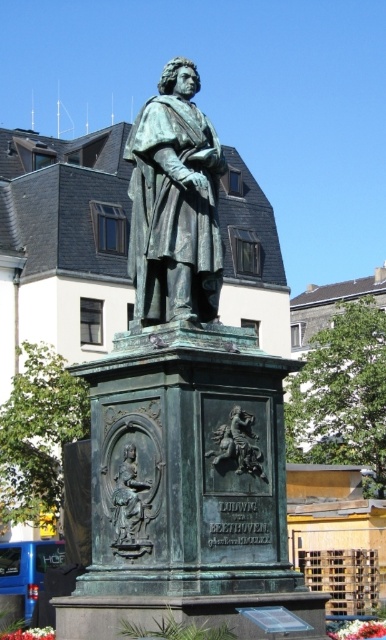
Question: Which object is positioned farthest from the bronze relief figure at center?

Choices:
 (A) bronze relief horse at center
 (B) bronze statue at center

Answer: (B)

Question: Does green patinated bronze statue at center have a smaller size compared to bronze relief figure at center?

Choices:
 (A) yes
 (B) no

Answer: (B)

Question: Estimate the real-world distances between objects in this image. Which object is closer to the bronze relief figure at center?

Choices:
 (A) green patinated bronze statue at center
 (B) bronze relief horse at center

Answer: (A)

Question: Can you confirm if green patinated bronze statue at center is positioned to the left of bronze relief figure at center?

Choices:
 (A) no
 (B) yes

Answer: (B)

Question: Which point is closer to the camera taking this photo?

Choices:
 (A) (140, 513)
 (B) (255, 460)
 (C) (165, 259)
 (D) (176, 509)

Answer: (D)

Question: Does green patinated bronze statue at center appear on the right side of bronze relief horse at center?

Choices:
 (A) no
 (B) yes

Answer: (A)